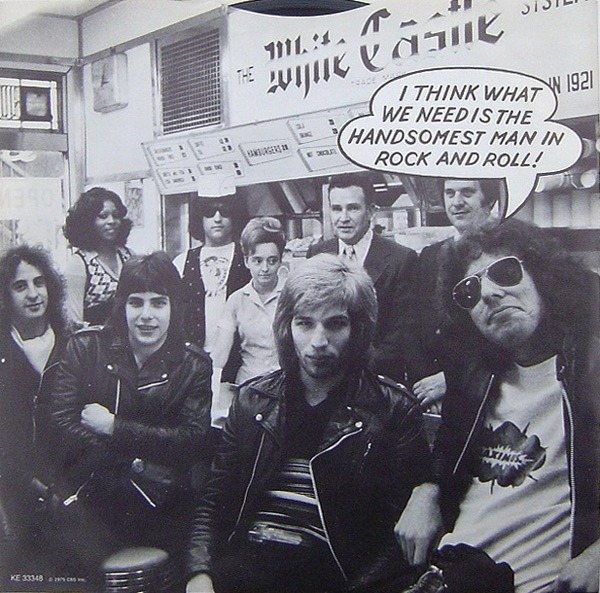
Locate an element on the screen. This screenshot has height=593, width=600. vent is located at coordinates (191, 76).